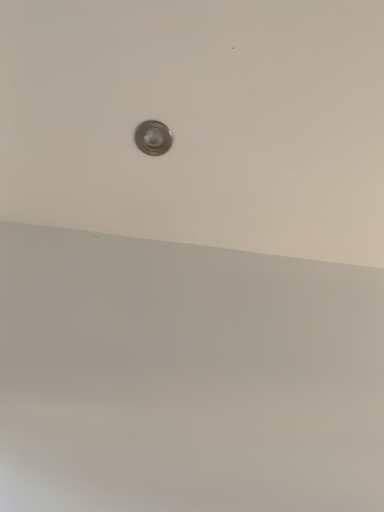
Image resolution: width=384 pixels, height=512 pixels. Describe the element at coordinates (198, 122) in the screenshot. I see `matte white ceiling at center` at that location.

I want to click on matte white ceiling at center, so click(198, 122).

Measure the distance between point (265, 173) and camera.

The distance of point (265, 173) from camera is 1.04 meters.

Locate an element on the screen. This screenshot has height=512, width=384. matte white ceiling at center is located at coordinates (198, 122).